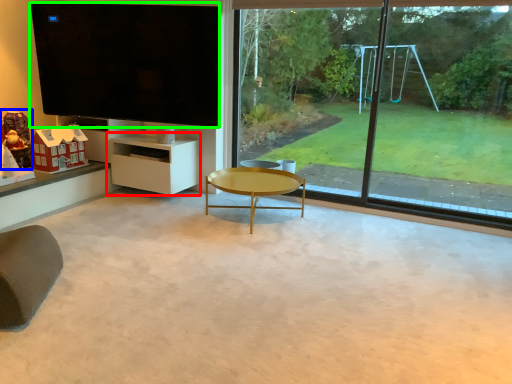
Question: Estimate the real-world distances between objects in this image. Which object is farther from shelf (highlighted by a red box), toy (highlighted by a blue box) or window screen (highlighted by a green box)?

Choices:
 (A) toy
 (B) window screen

Answer: (A)